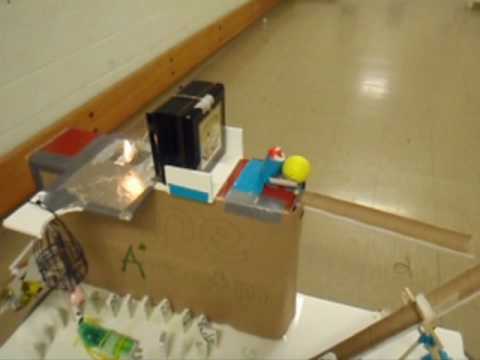
Image resolution: width=480 pixels, height=360 pixels. In order to click on floor in this screenshot , I will do `click(442, 143)`, `click(341, 276)`.